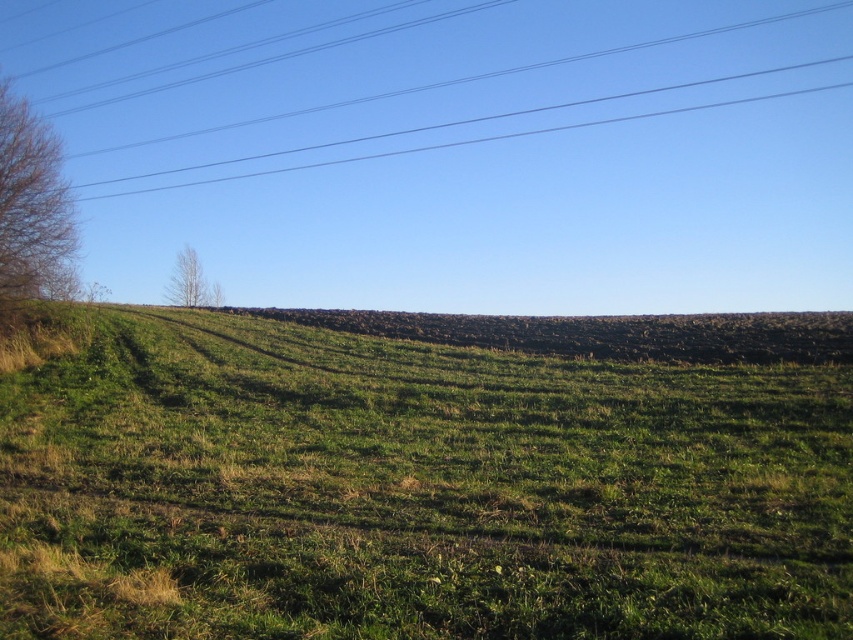
Does metallic wires at upper center have a lesser height compared to bare branches at left?

No.

In order to click on metallic wires at upper center in this screenshot , I will do `click(473, 77)`.

Who is taller, green grassy field at center or green leafy tree at upper left?

green leafy tree at upper left is taller.

Who is positioned more to the right, green grassy field at center or green leafy tree at upper left?

green grassy field at center is more to the right.

Where is `green grassy field at center`? green grassy field at center is located at coordinates (415, 490).

Is point (7, 141) more distant than point (171, 276)?

No, it is not.

Who is shorter, bare branches at left or green leafy tree at upper left?

Standing shorter between the two is green leafy tree at upper left.

In order to click on bare branches at left in this screenshot , I will do `click(32, 211)`.